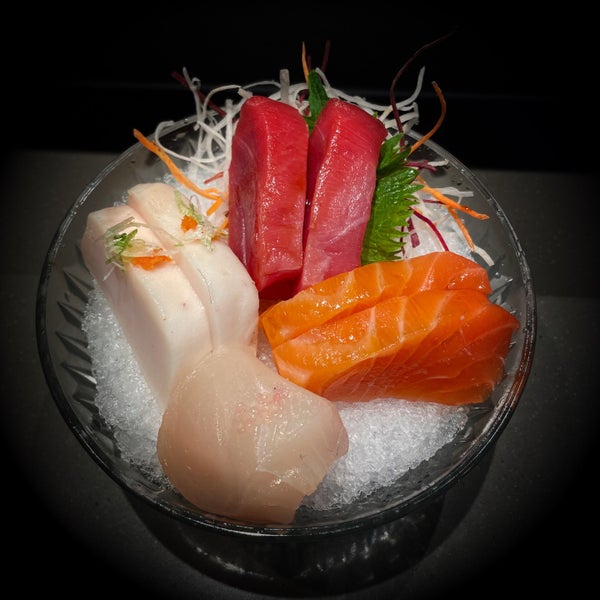
Locate an element on the screen. glass bowl is located at coordinates (62, 317).